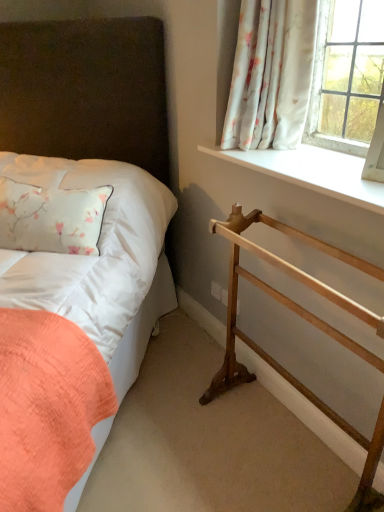
Question: Is white floral fabric at upper right in contact with wooden towel rack at lower right?

Choices:
 (A) yes
 (B) no

Answer: (B)

Question: Are white floral fabric at upper right and wooden towel rack at lower right located far from each other?

Choices:
 (A) no
 (B) yes

Answer: (A)

Question: Would you say white floral fabric at upper right is outside wooden towel rack at lower right?

Choices:
 (A) yes
 (B) no

Answer: (A)

Question: From the image's perspective, would you say white floral fabric at upper right is shown under wooden towel rack at lower right?

Choices:
 (A) no
 (B) yes

Answer: (A)

Question: Considering the relative sizes of white floral fabric at upper right and wooden towel rack at lower right in the image provided, is white floral fabric at upper right thinner than wooden towel rack at lower right?

Choices:
 (A) no
 (B) yes

Answer: (B)

Question: Is white floral fabric at upper right oriented away from wooden towel rack at lower right?

Choices:
 (A) no
 (B) yes

Answer: (A)

Question: From a real-world perspective, is matte white bed at left positioned under white smooth window sill at upper right based on gravity?

Choices:
 (A) yes
 (B) no

Answer: (A)

Question: Is matte white bed at left at the right side of white smooth window sill at upper right?

Choices:
 (A) yes
 (B) no

Answer: (B)

Question: Is white smooth window sill at upper right surrounded by matte white bed at left?

Choices:
 (A) no
 (B) yes

Answer: (A)

Question: Can you confirm if matte white bed at left is thinner than white smooth window sill at upper right?

Choices:
 (A) no
 (B) yes

Answer: (A)

Question: Is matte white bed at left taller than white smooth window sill at upper right?

Choices:
 (A) yes
 (B) no

Answer: (A)

Question: From a real-world perspective, is matte white bed at left positioned over white smooth window sill at upper right based on gravity?

Choices:
 (A) no
 (B) yes

Answer: (A)

Question: Does white smooth window sill at upper right have a larger size compared to white satin pillow at left?

Choices:
 (A) yes
 (B) no

Answer: (B)